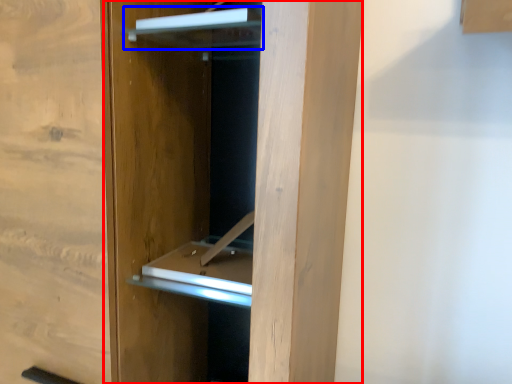
Question: Which of the following is the closest to the observer, door (highlighted by a red box) or cabinet (highlighted by a blue box)?

Choices:
 (A) door
 (B) cabinet

Answer: (A)